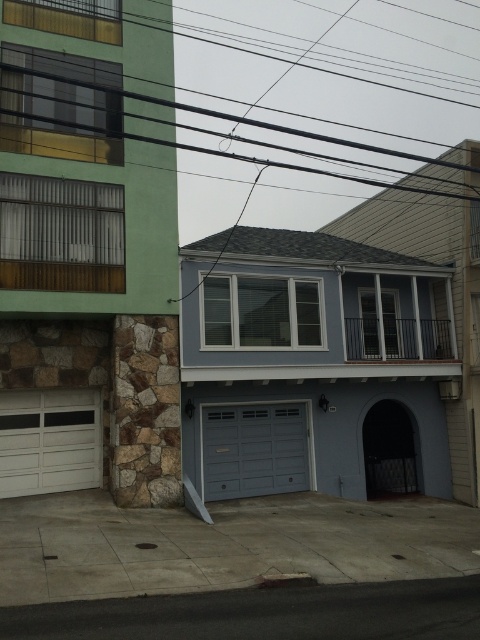
You are a delivery person trying to navigate through the residential street scene. There is a black wire at upper center. Can you safely pass under it without hitting your head?

The black wire at upper center is located at coordinates point (310, 115). Since the exact height isn